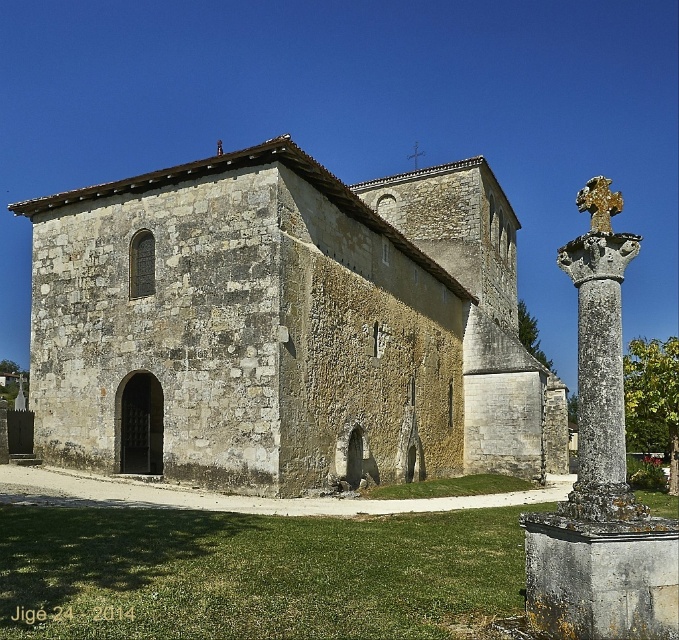
Which is more to the right, stone church at center or stone cross at right?

Positioned to the right is stone cross at right.

Is point (220, 483) closer to camera compared to point (631, 502)?

No.

Is point (375, 460) more distant than point (600, 237)?

That is True.

Where is `stone church at center`? The width and height of the screenshot is (679, 640). stone church at center is located at coordinates (285, 326).

Is point (189, 456) less distant than point (642, 637)?

That is False.

The width and height of the screenshot is (679, 640). I want to click on stone church at center, so click(x=285, y=326).

The width and height of the screenshot is (679, 640). What do you see at coordinates (600, 472) in the screenshot? I see `gold textured cross at right` at bounding box center [600, 472].

Where is `gold textured cross at right`? This screenshot has width=679, height=640. gold textured cross at right is located at coordinates (600, 472).

Is point (629, 552) closer to camera compared to point (608, 195)?

Yes, point (629, 552) is closer to viewer.

I want to click on gold textured cross at right, so click(x=600, y=472).